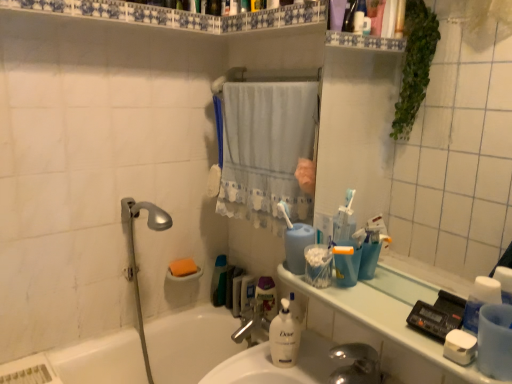
Question: Considering the relative positions of white matte soap at lower right, the first soap viewed from the right, and green plastic bottle at center in the image provided, is white matte soap at lower right, the first soap viewed from the right, to the left or to the right of green plastic bottle at center?

Choices:
 (A) left
 (B) right

Answer: (B)

Question: From a real-world perspective, relative to green plastic bottle at center, is white matte soap at lower right, the 1th soap positioned from the front, vertically above or below?

Choices:
 (A) above
 (B) below

Answer: (A)

Question: Considering the real-world distances, which object is farthest from the silver metallic shower head at left?

Choices:
 (A) blue matte cup at center, which ranks as the 2th cleaning product in bottom-to-top order
 (B) white matte soap at lower right, the 2th soap from the back
 (C) silver metallic faucet at sink center
 (D) white glossy counter top at upper right
 (E) white glossy sink at center

Answer: (B)

Question: Based on their relative distances, which object is nearer to the white matte bottle at center, acting as the 1th cleaning product starting from the bottom?

Choices:
 (A) white glossy bathtub at lower left
 (B) orange sponge at lower left, marked as the first soap in a back-to-front arrangement
 (C) silver metallic faucet at sink center
 (D) white glossy sink at center
 (E) blue matte cup at center, marked as the first cleaning product in a top-to-bottom arrangement

Answer: (D)